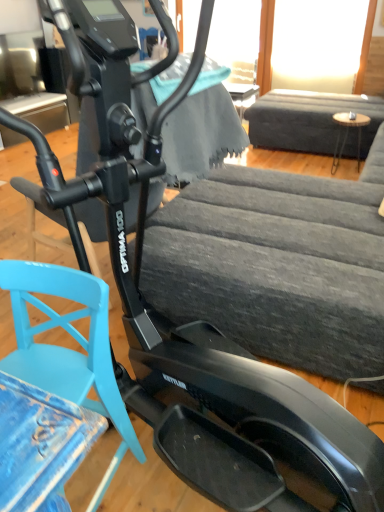
The image size is (384, 512). Identify the location of light blue plastic swivel chair at lower left. (68, 349).

What do you see at coordinates (347, 133) in the screenshot? I see `wooden round table at right` at bounding box center [347, 133].

Where is `light blue plastic swivel chair at lower left`? This screenshot has width=384, height=512. light blue plastic swivel chair at lower left is located at coordinates (68, 349).

Is there a large distance between dark gray fabric couch at upper right and wooden round table at right?

No.

Which is behind, dark gray fabric couch at upper right or wooden round table at right?

Positioned behind is dark gray fabric couch at upper right.

From the image's perspective, is dark gray fabric couch at upper right under wooden round table at right?

No, from the image's perspective, dark gray fabric couch at upper right is not below wooden round table at right.

Is dark gray fabric couch at upper right facing towards wooden round table at right?

No.

Considering the sizes of objects wooden round table at right and dark gray fabric couch at upper right in the image provided, who is smaller, wooden round table at right or dark gray fabric couch at upper right?

With smaller size is wooden round table at right.

From a real-world perspective, is wooden round table at right located higher than dark gray fabric couch at upper right?

No, from a real-world perspective, wooden round table at right is not above dark gray fabric couch at upper right.

From the image's perspective, which is below, wooden round table at right or dark gray fabric couch at upper right?

From the image's view, wooden round table at right is below.

The image size is (384, 512). I want to click on table below the dark gray fabric couch at upper right (from the image's perspective), so click(x=347, y=133).

Which is behind, light blue plastic swivel chair at lower left or dark gray fabric couch at upper right?

dark gray fabric couch at upper right is further from the camera.

From the image's perspective, is light blue plastic swivel chair at lower left on top of dark gray fabric couch at upper right?

No, from the image's perspective, light blue plastic swivel chair at lower left is not over dark gray fabric couch at upper right.

Measure the distance from light blue plastic swivel chair at lower left to dark gray fabric couch at upper right.

A distance of 11.33 feet exists between light blue plastic swivel chair at lower left and dark gray fabric couch at upper right.

Does light blue plastic swivel chair at lower left turn towards dark gray fabric couch at upper right?

No.

Does light blue plastic swivel chair at lower left have a smaller size compared to wooden round table at right?

Actually, light blue plastic swivel chair at lower left might be larger than wooden round table at right.

Looking at this image, considering the sizes of light blue plastic swivel chair at lower left and wooden round table at right in the image, is light blue plastic swivel chair at lower left wider or thinner than wooden round table at right?

light blue plastic swivel chair at lower left is wider than wooden round table at right.

Identify the location of swivel chair on the left side of wooden round table at right. This screenshot has height=512, width=384. (68, 349).

Is dark gray fabric couch at upper right further to camera compared to light blue plastic swivel chair at lower left?

Yes, it is behind light blue plastic swivel chair at lower left.

Between point (281, 136) and point (58, 383), which one is positioned behind?

The point (281, 136) is farther from the camera.

Who is taller, dark gray fabric couch at upper right or light blue plastic swivel chair at lower left?

dark gray fabric couch at upper right.

Is dark gray fabric couch at upper right situated inside light blue plastic swivel chair at lower left or outside?

dark gray fabric couch at upper right is not inside light blue plastic swivel chair at lower left, it's outside.

Visually, is wooden round table at right positioned to the left or to the right of light blue plastic swivel chair at lower left?

Based on their positions, wooden round table at right is located to the right of light blue plastic swivel chair at lower left.

Where is `swivel chair on the left of wooden round table at right`? The image size is (384, 512). swivel chair on the left of wooden round table at right is located at coordinates (68, 349).

Relative to light blue plastic swivel chair at lower left, is wooden round table at right in front or behind?

wooden round table at right is positioned farther from the viewer than light blue plastic swivel chair at lower left.

You are a GUI agent. You are given a task and a screenshot of the screen. Output one action in this format:
    pyautogui.click(x=<x>, y=<y>)
    Task: Click on the table to the left of dark gray fabric couch at upper right
    Image resolution: width=384 pixels, height=512 pixels.
    Given the screenshot: What is the action you would take?
    pyautogui.click(x=347, y=133)

Identify the location of table below the dark gray fabric couch at upper right (from the image's perspective). (347, 133).

From the image, which object appears to be nearer to light blue plastic swivel chair at lower left, wooden round table at right or dark gray fabric couch at upper right?

Based on the image, wooden round table at right appears to be nearer to light blue plastic swivel chair at lower left.

Considering their positions, is light blue plastic swivel chair at lower left positioned closer to dark gray fabric couch at upper right than wooden round table at right?

wooden round table at right is closer to dark gray fabric couch at upper right.

When comparing their distances from light blue plastic swivel chair at lower left, does dark gray fabric couch at upper right or wooden round table at right seem further?

dark gray fabric couch at upper right is further to light blue plastic swivel chair at lower left.

Looking at the image, which one is located closer to wooden round table at right, dark gray fabric couch at upper right or light blue plastic swivel chair at lower left?

The object closer to wooden round table at right is dark gray fabric couch at upper right.

Consider the image. When comparing their distances from wooden round table at right, does light blue plastic swivel chair at lower left or dark gray fabric couch at upper right seem closer?

Among the two, dark gray fabric couch at upper right is located nearer to wooden round table at right.

In the scene shown: Based on their spatial positions, is wooden round table at right or light blue plastic swivel chair at lower left closer to dark gray fabric couch at upper right?

The object closer to dark gray fabric couch at upper right is wooden round table at right.

At what (x,y) coordinates should I click in order to perform the action: click on table located between light blue plastic swivel chair at lower left and dark gray fabric couch at upper right in the depth direction. Please return your answer as a coordinate pair (x, y). The image size is (384, 512). Looking at the image, I should click on (347, 133).